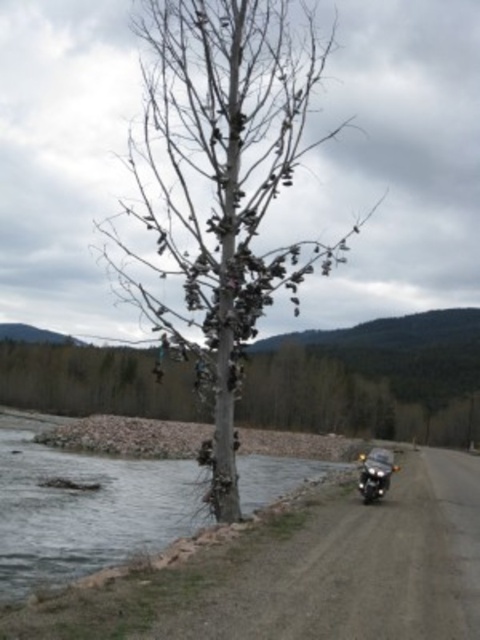
You are standing on the dirt road in the scene and want to take a photo of both the shiny black motorcycle at right and the clear water at lower left. Which object should you adjust your camera focus to first to ensure both are in the frame?

Since the clear water at lower left is closer to the viewer than the shiny black motorcycle at right, you should focus on the clear water at lower left first to ensure both are in the frame.

Based on the photo, you are standing on the dirt road in the foreground of the scene. You want to place a new pair of shoes exactly where the shiny metallic shoes at center are currently located. According to the coordinates provided, what are the coordinates you should aim for?

The coordinates you should aim for are point (220, 186) where the shiny metallic shoes at center are located.